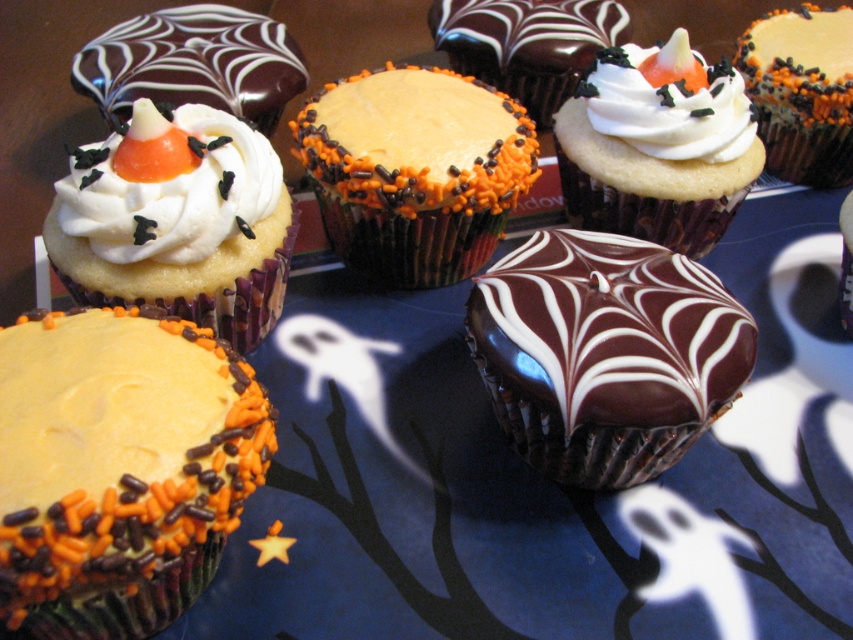
Question: Which point is farther to the camera?

Choices:
 (A) (143, 74)
 (B) (91, 180)
 (C) (753, 132)

Answer: (A)

Question: Where is orange sprinkled cupcake at center-left located in relation to yellow cake with orange sprinkles at center in the image?

Choices:
 (A) above
 (B) below

Answer: (B)

Question: Which of the following is the farthest from the observer?

Choices:
 (A) (639, 51)
 (B) (801, 19)
 (C) (196, 474)

Answer: (B)

Question: Which point is farther to the camera?

Choices:
 (A) (364, 84)
 (B) (492, 77)

Answer: (B)

Question: Can you confirm if orange sprinkled cupcake at center-left is positioned to the right of white cream cupcake at center?

Choices:
 (A) yes
 (B) no

Answer: (B)

Question: Does orange sprinkled cupcake at center-left lie behind white cream cupcake at center?

Choices:
 (A) no
 (B) yes

Answer: (A)